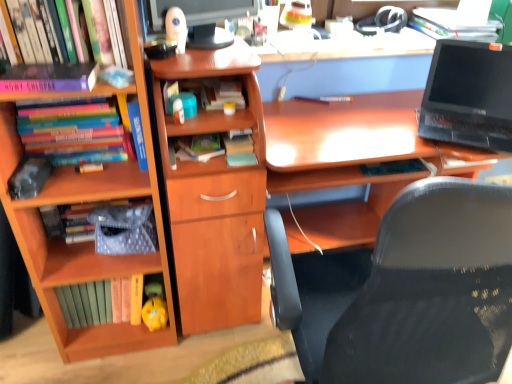
Locate an element on the screen. Image resolution: width=512 pixels, height=384 pixels. vacant space situated on the left part of black plastic laptop at right is located at coordinates (370, 122).